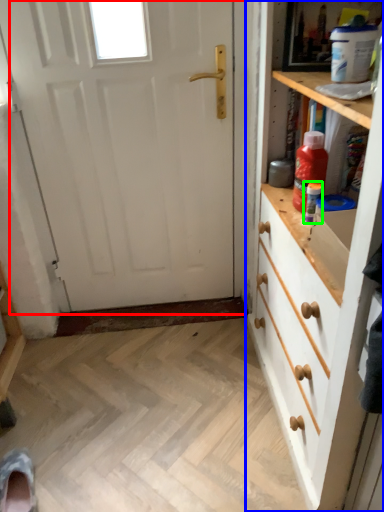
Question: Based on their relative distances, which object is nearer to door (highlighted by a red box)? Choose from chest of drawers (highlighted by a blue box) and bottle (highlighted by a green box).

Choices:
 (A) chest of drawers
 (B) bottle

Answer: (A)